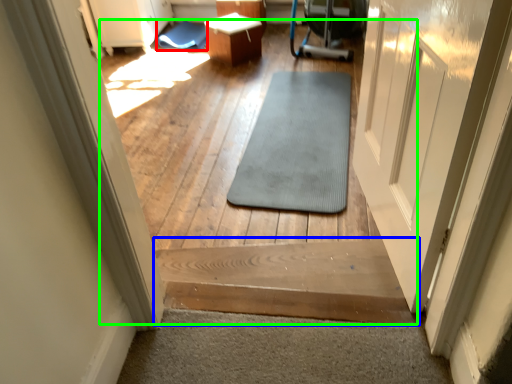
Question: Based on their relative distances, which object is nearer to mat (highlighted by a red box)? Choose from stairs (highlighted by a blue box) and path (highlighted by a green box).

Choices:
 (A) stairs
 (B) path

Answer: (B)